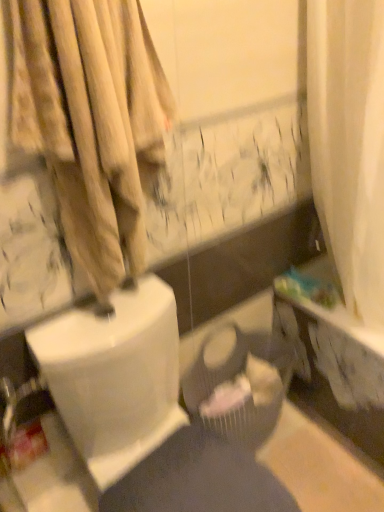
Question: Should I look upward or downward to see beige textured curtain at left?

Choices:
 (A) up
 (B) down

Answer: (A)